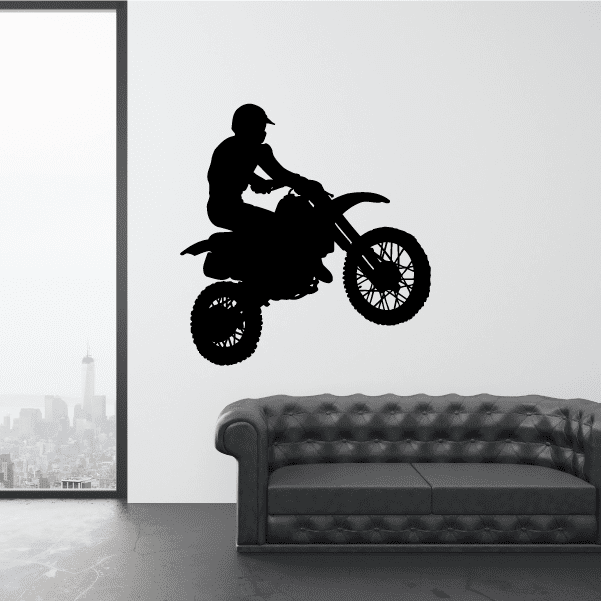
Locate an element on the screen. couch backing is located at coordinates (410, 422).